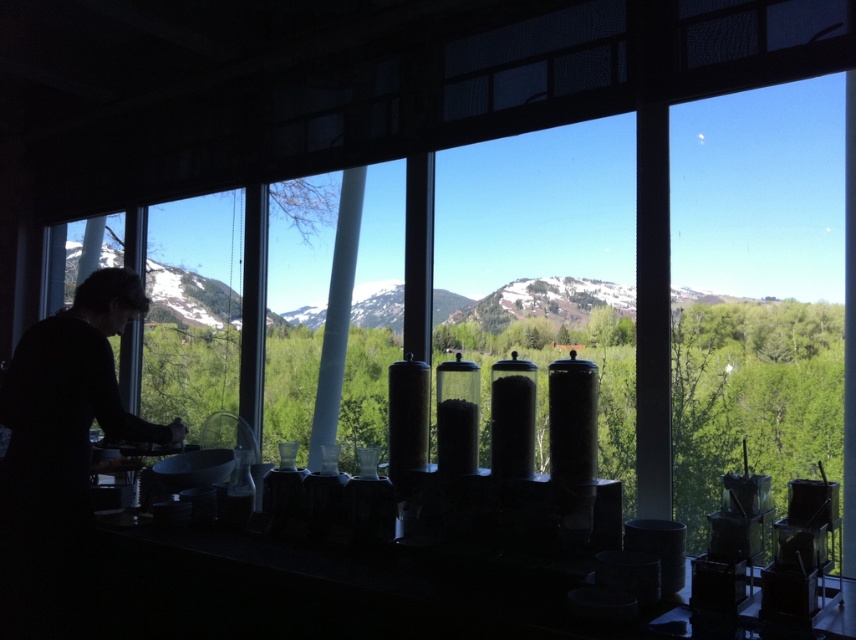
Question: Is transparent glass containers at center below transparent glass window at center?

Choices:
 (A) yes
 (B) no

Answer: (A)

Question: Which object is the closest to the transparent glass window at center?

Choices:
 (A) transparent glass containers at center
 (B) transparent glass window at left

Answer: (B)

Question: Is transparent glass containers at center thinner than transparent glass window at center?

Choices:
 (A) yes
 (B) no

Answer: (B)

Question: Which object is the farthest from the transparent glass window at left?

Choices:
 (A) snowy mountain at center
 (B) transparent glass containers at center

Answer: (B)

Question: Where is transparent glass containers at center located in relation to transparent glass window at center in the image?

Choices:
 (A) below
 (B) above

Answer: (A)

Question: Which of the following is the farthest from the observer?

Choices:
 (A) (217, 257)
 (B) (322, 253)

Answer: (A)